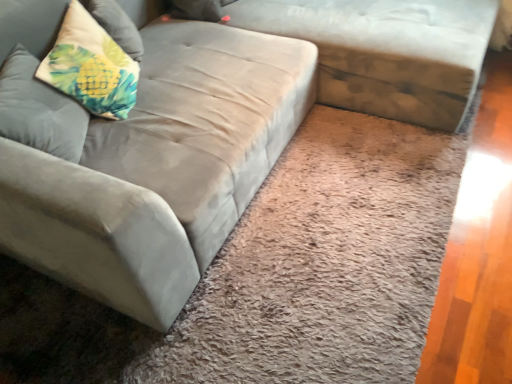
What do you see at coordinates (379, 50) in the screenshot? I see `suede gray couch at center` at bounding box center [379, 50].

I want to click on fluffy fabric pillow at upper left, the 1th pillow ordered from the bottom, so click(39, 110).

Between suede gray couch at center and textured beige pillow at upper left, placed as the 2th pillow when sorted from bottom to top, which one has larger size?

With larger size is suede gray couch at center.

Is suede gray couch at center thinner than textured beige pillow at upper left, the first pillow viewed from the top?

No.

Is textured beige pillow at upper left, the first pillow viewed from the top, completely or partially inside suede gray couch at center?

No, textured beige pillow at upper left, the first pillow viewed from the top, is located outside of suede gray couch at center.

Is suede gray couch at center placed right next to fluffy fabric pillow at upper left, the 1th pillow ordered from the bottom?

No, suede gray couch at center is not with fluffy fabric pillow at upper left, the 1th pillow ordered from the bottom.

Between suede gray couch at center and fluffy fabric pillow at upper left, which is the second pillow from top to bottom, which one has smaller width?

fluffy fabric pillow at upper left, which is the second pillow from top to bottom, is thinner.

Is point (322, 47) less distant than point (32, 119)?

No.

This screenshot has width=512, height=384. Identify the location of studio couch behind the textured beige pillow at upper left, the first pillow viewed from the top. (379, 50).

From their relative heights in the image, would you say textured beige pillow at upper left, the first pillow viewed from the top, is taller or shorter than suede gray couch at center?

In the image, textured beige pillow at upper left, the first pillow viewed from the top, appears to be shorter than suede gray couch at center.

Does textured beige pillow at upper left, placed as the 2th pillow when sorted from bottom to top, have a lesser width compared to suede gray couch at center?

Yes.

Is textured beige pillow at upper left, the first pillow viewed from the top, inside the boundaries of suede gray couch at center, or outside?

textured beige pillow at upper left, the first pillow viewed from the top, is not inside suede gray couch at center, it's outside.

Is fluffy fabric pillow at upper left, the 1th pillow ordered from the bottom, spatially inside textured beige pillow at upper left, placed as the 2th pillow when sorted from bottom to top, or outside of it?

fluffy fabric pillow at upper left, the 1th pillow ordered from the bottom, lies within the bounds of textured beige pillow at upper left, placed as the 2th pillow when sorted from bottom to top.

Consider the image. From a real-world perspective, is fluffy fabric pillow at upper left, the 1th pillow ordered from the bottom, below textured beige pillow at upper left, placed as the 2th pillow when sorted from bottom to top?

Yes, from a real-world perspective, fluffy fabric pillow at upper left, the 1th pillow ordered from the bottom, is below textured beige pillow at upper left, placed as the 2th pillow when sorted from bottom to top.

This screenshot has width=512, height=384. There is a suede gray couch at center. In order to click on the 2nd pillow below it (from the image's perspective) in this screenshot , I will do `click(39, 110)`.

Is fluffy fabric pillow at upper left, the 1th pillow ordered from the bottom, at the left side of suede gray couch at center?

Yes.

Which of these two, fluffy fabric pillow at upper left, which is the second pillow from top to bottom, or suede gray couch at center, is thinner?

fluffy fabric pillow at upper left, which is the second pillow from top to bottom, is thinner.

Could you tell me if fluffy fabric pillow at upper left, the 1th pillow ordered from the bottom, is turned towards suede gray couch at center?

No, fluffy fabric pillow at upper left, the 1th pillow ordered from the bottom, is not aimed at suede gray couch at center.

Which is more to the left, textured beige pillow at upper left, placed as the 2th pillow when sorted from bottom to top, or fluffy fabric pillow at upper left, the 1th pillow ordered from the bottom?

fluffy fabric pillow at upper left, the 1th pillow ordered from the bottom, is more to the left.

From the image's perspective, is textured beige pillow at upper left, the first pillow viewed from the top, located above fluffy fabric pillow at upper left, the 1th pillow ordered from the bottom?

Yes, from the image's perspective, textured beige pillow at upper left, the first pillow viewed from the top, is on top of fluffy fabric pillow at upper left, the 1th pillow ordered from the bottom.

Where is `pillow that appears in front of the textured beige pillow at upper left, placed as the 2th pillow when sorted from bottom to top`? pillow that appears in front of the textured beige pillow at upper left, placed as the 2th pillow when sorted from bottom to top is located at coordinates (39, 110).

Does textured beige pillow at upper left, the first pillow viewed from the top, have a smaller size compared to fluffy fabric pillow at upper left, the 1th pillow ordered from the bottom?

Actually, textured beige pillow at upper left, the first pillow viewed from the top, might be larger than fluffy fabric pillow at upper left, the 1th pillow ordered from the bottom.

Identify the location of the 2nd pillow directly above the suede gray couch at center (from a real-world perspective). The width and height of the screenshot is (512, 384). (91, 66).

Identify the location of studio couch behind the fluffy fabric pillow at upper left, which is the second pillow from top to bottom. The height and width of the screenshot is (384, 512). (379, 50).

When comparing their distances from textured beige pillow at upper left, placed as the 2th pillow when sorted from bottom to top, does suede gray couch at center or fluffy fabric pillow at upper left, which is the second pillow from top to bottom, seem closer?

fluffy fabric pillow at upper left, which is the second pillow from top to bottom, is closer to textured beige pillow at upper left, placed as the 2th pillow when sorted from bottom to top.

Looking at the image, which one is located further to textured beige pillow at upper left, placed as the 2th pillow when sorted from bottom to top, fluffy fabric pillow at upper left, the 1th pillow ordered from the bottom, or suede gray couch at center?

suede gray couch at center is positioned further to the anchor textured beige pillow at upper left, placed as the 2th pillow when sorted from bottom to top.

When comparing their distances from fluffy fabric pillow at upper left, the 1th pillow ordered from the bottom, does suede gray couch at center or textured beige pillow at upper left, placed as the 2th pillow when sorted from bottom to top, seem further?

suede gray couch at center.

Based on their spatial positions, is fluffy fabric pillow at upper left, the 1th pillow ordered from the bottom, or textured beige pillow at upper left, placed as the 2th pillow when sorted from bottom to top, further from suede gray couch at center?

fluffy fabric pillow at upper left, the 1th pillow ordered from the bottom, lies further to suede gray couch at center than the other object.

Estimate the real-world distances between objects in this image. Which object is further from fluffy fabric pillow at upper left, the 1th pillow ordered from the bottom, textured beige pillow at upper left, the first pillow viewed from the top, or suede gray couch at center?

suede gray couch at center.

From the image, which object appears to be nearer to suede gray couch at center, textured beige pillow at upper left, the first pillow viewed from the top, or fluffy fabric pillow at upper left, which is the second pillow from top to bottom?

textured beige pillow at upper left, the first pillow viewed from the top, is closer to suede gray couch at center.

Where is `pillow between fluffy fabric pillow at upper left, the 1th pillow ordered from the bottom, and suede gray couch at center`? pillow between fluffy fabric pillow at upper left, the 1th pillow ordered from the bottom, and suede gray couch at center is located at coordinates (91, 66).